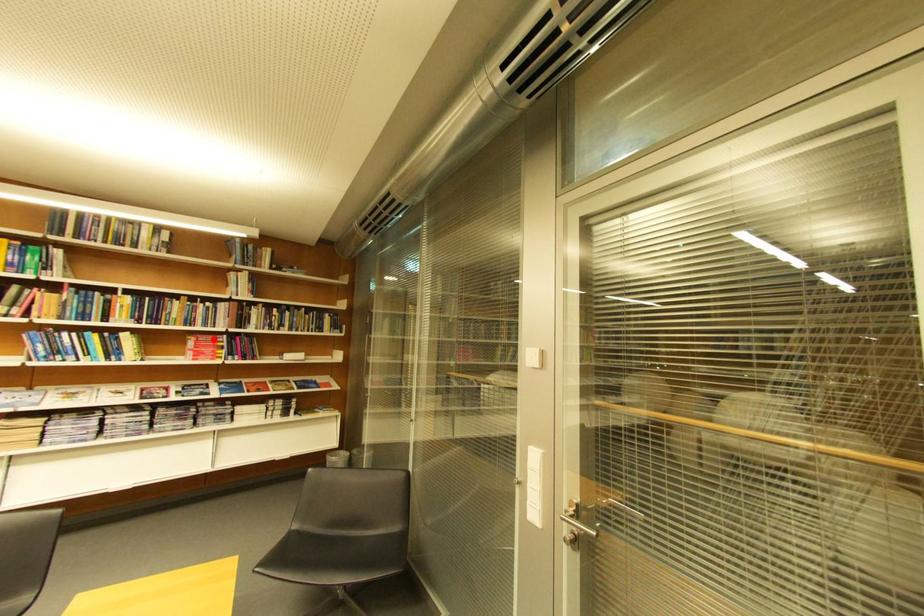
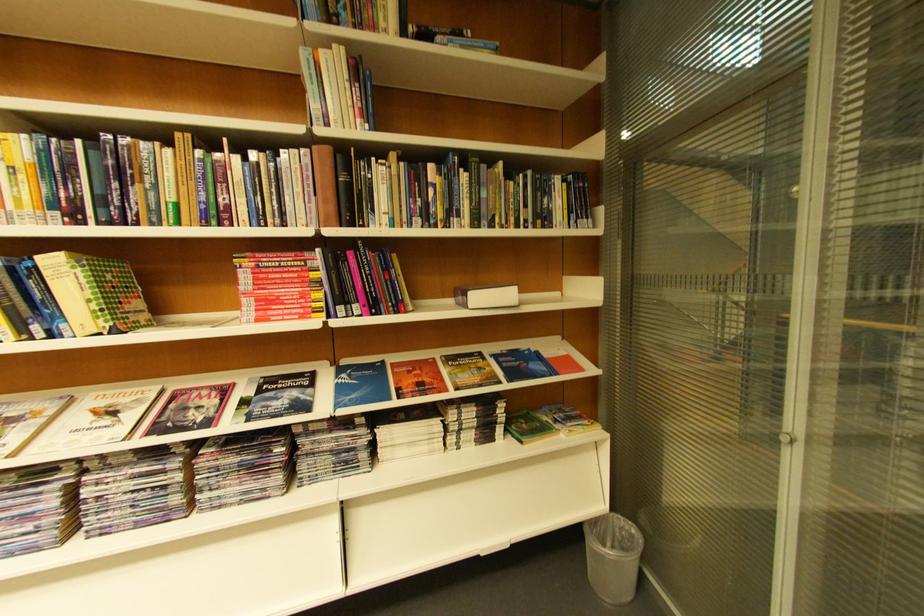
Where in the second image is the point corresponding to the highlighted location from the first image?

(281, 262)